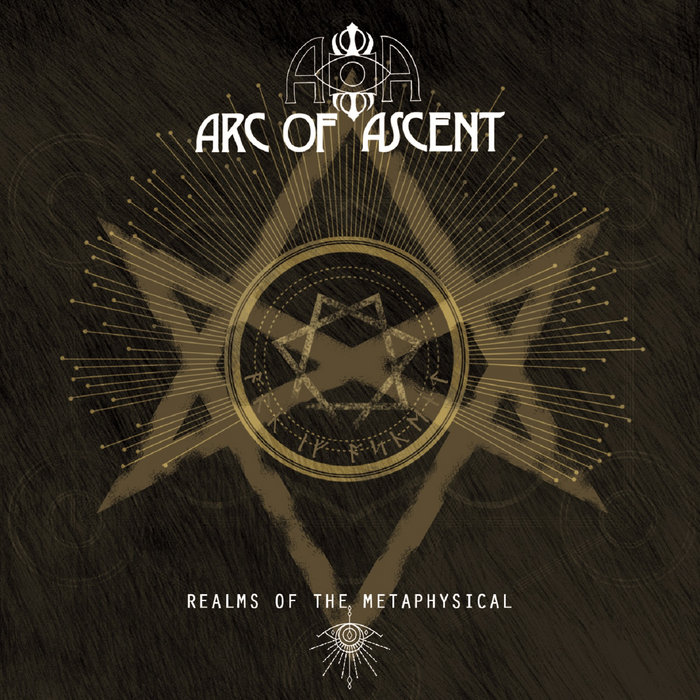
Locate an element on the screen. wood looking background is located at coordinates (71, 586).